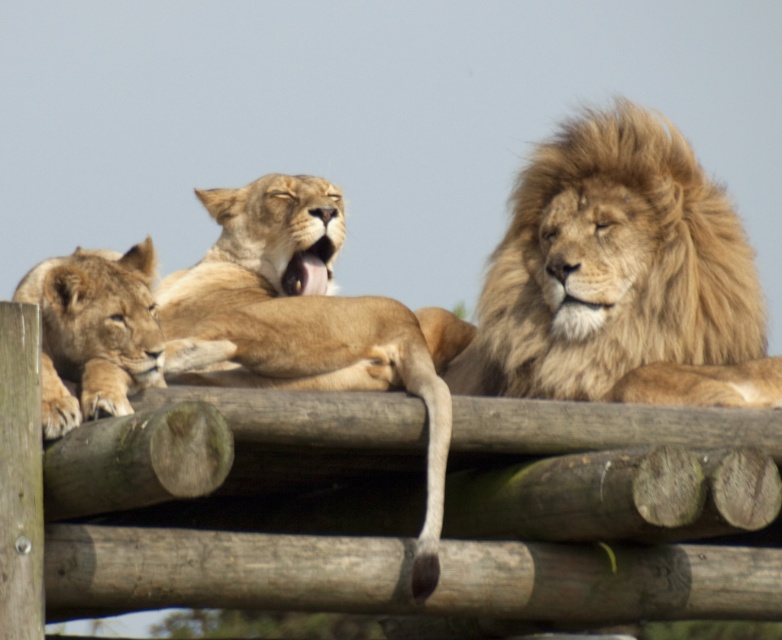
You are a GUI agent. You are given a task and a screenshot of the screen. Output one action in this format:
    pyautogui.click(x=<x>, y=<y>)
    Task: Click on the golden fur lion at right
    The image size is (782, 640).
    Given the screenshot: What is the action you would take?
    point(619,276)

Which is behind, point (673, 248) or point (336, 310)?

The point (673, 248) is behind.

Find the location of a particular element. golden fur lion at right is located at coordinates (619, 276).

Which is above, golden fur lion at right or golden fur lion cub at left?

golden fur lion cub at left is above.

Between golden fur lion at right and golden fur lion cub at left, which one appears on the right side from the viewer's perspective?

From the viewer's perspective, golden fur lion at right appears more on the right side.

Is point (648, 314) closer to camera compared to point (52, 337)?

No, (648, 314) is further to viewer.

Find the location of a particular element. This screenshot has height=640, width=782. golden fur lion at right is located at coordinates (x=619, y=276).

Does golden fur lion at center have a lesser width compared to golden fur lion cub at left?

In fact, golden fur lion at center might be wider than golden fur lion cub at left.

Does golden fur lion at center appear on the left side of golden fur lion cub at left?

Incorrect, golden fur lion at center is not on the left side of golden fur lion cub at left.

This screenshot has height=640, width=782. Find the location of `golden fur lion at center`. golden fur lion at center is located at coordinates (310, 321).

Where is `golden fur lion at center`? golden fur lion at center is located at coordinates (310, 321).